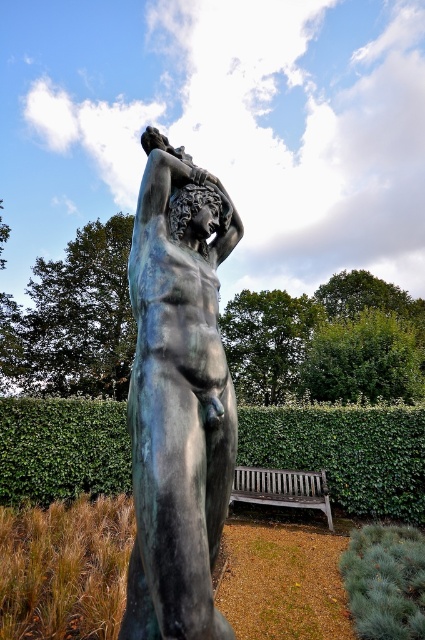
Question: Does green leafy hedge at center have a smaller size compared to wooden bench at lower center?

Choices:
 (A) no
 (B) yes

Answer: (A)

Question: Does green leafy hedge at center have a greater width compared to wooden bench at lower center?

Choices:
 (A) yes
 (B) no

Answer: (A)

Question: Which of these objects is positioned closest to the bronze statue at center?

Choices:
 (A) green leafy hedge at center
 (B) wooden bench at lower center

Answer: (B)

Question: Which point appears closest to the camera in this image?

Choices:
 (A) (172, 461)
 (B) (317, 474)

Answer: (A)

Question: Does green leafy hedge at center have a lesser width compared to wooden bench at lower center?

Choices:
 (A) no
 (B) yes

Answer: (A)

Question: Which object is the closest to the green leafy hedge at center?

Choices:
 (A) bronze statue at center
 (B) wooden bench at lower center

Answer: (B)